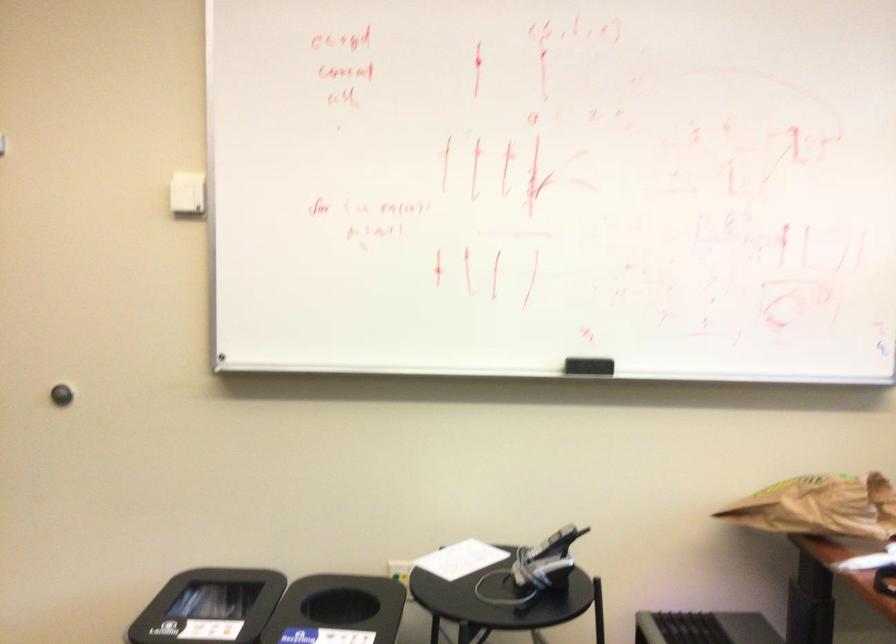
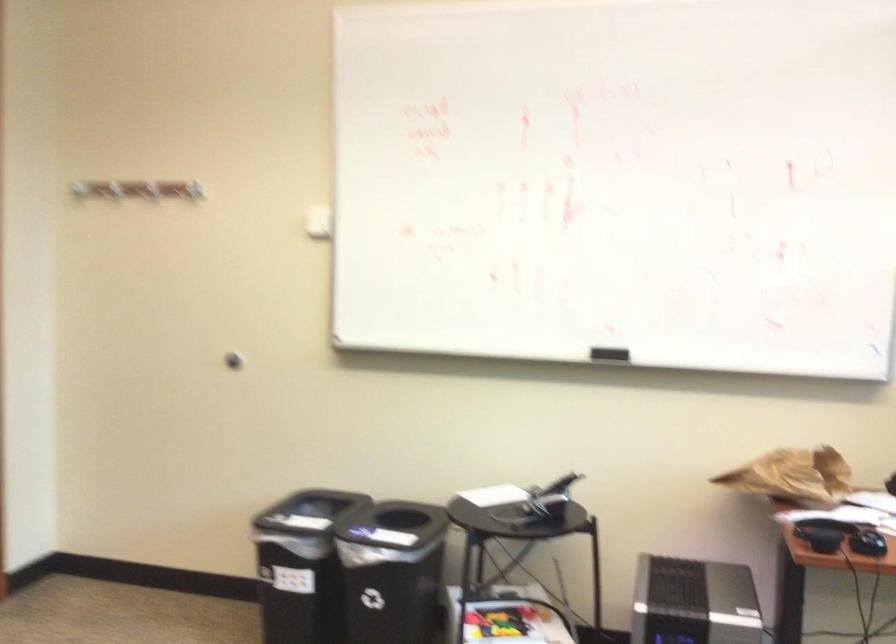
Where in the second image is the point corresponding to point 588,366 from the first image?

(608, 354)